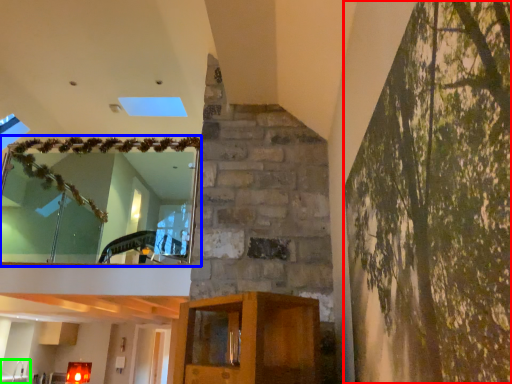
Question: Estimate the real-world distances between objects in this image. Which object is farther from tree (highlighted by a red box), window (highlighted by a blue box) or sink (highlighted by a green box)?

Choices:
 (A) window
 (B) sink

Answer: (B)